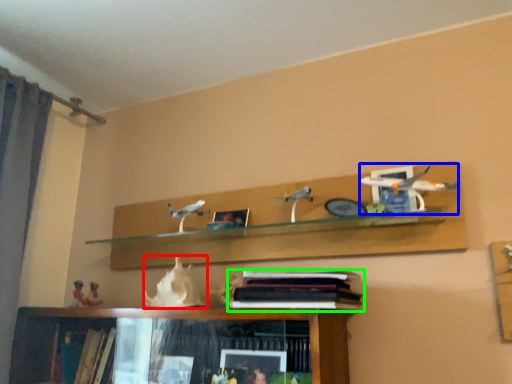
Question: Based on their relative distances, which object is farther from animal (highlighted by a red box)? Choose from toy (highlighted by a blue box) and book (highlighted by a green box).

Choices:
 (A) toy
 (B) book

Answer: (A)